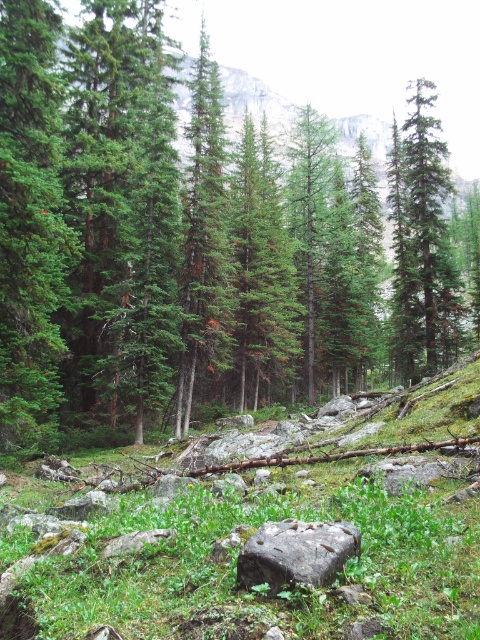
What do you see at coordinates (183, 243) in the screenshot? Image resolution: width=480 pixels, height=640 pixels. I see `green matte tree at center` at bounding box center [183, 243].

Between green matte tree at center and gray rough rock at center, which one appears on the right side from the viewer's perspective?

green matte tree at center is more to the right.

Between point (327, 392) and point (331, 547), which one is positioned behind?

Point (327, 392)

In order to click on green matte tree at center in this screenshot , I will do `click(183, 243)`.

Is green matte tree at upper right taller than gray rough rock at center?

Yes.

In the scene shown: Who is higher up, green matte tree at upper right or gray rough rock at center?

Positioned higher is green matte tree at upper right.

What do you see at coordinates (421, 241) in the screenshot? The height and width of the screenshot is (640, 480). I see `green matte tree at upper right` at bounding box center [421, 241].

I want to click on green matte tree at upper right, so click(421, 241).

Is point (252, 372) less distant than point (389, 168)?

Yes, it is in front of point (389, 168).

Between point (168, 168) and point (425, 195), which one is positioned behind?

The point (425, 195) is more distant.

The width and height of the screenshot is (480, 640). What do you see at coordinates (183, 243) in the screenshot?
I see `green matte tree at center` at bounding box center [183, 243].

Identify the location of green matte tree at center. (183, 243).